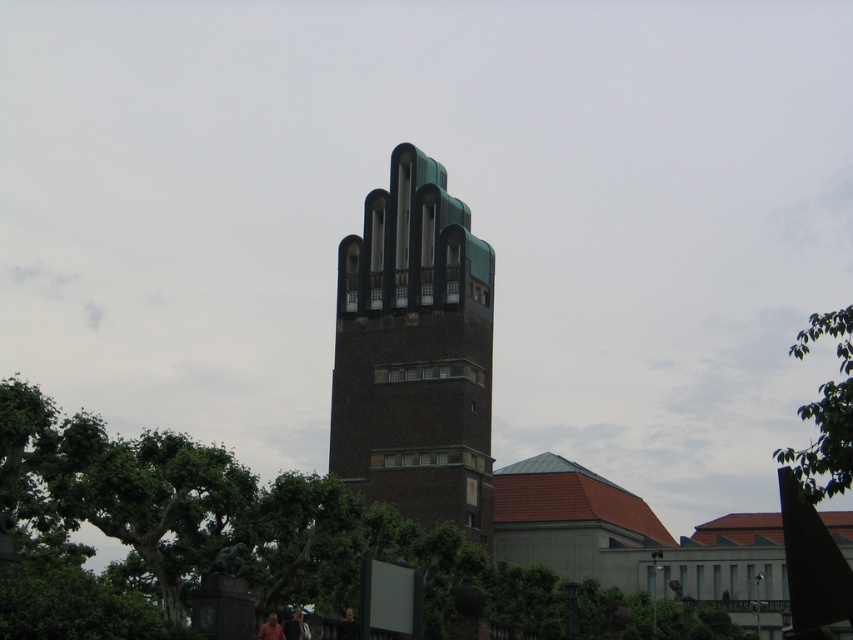
Is brown brick tower at center taller than green leafy tree at upper right?

Yes.

Can you confirm if brown brick tower at center is bigger than green leafy tree at upper right?

No, brown brick tower at center is not bigger than green leafy tree at upper right.

Locate an element on the screen. brown brick tower at center is located at coordinates (415, 353).

Is green leafy tree at center below green leafy tree at upper right?

Indeed, green leafy tree at center is positioned under green leafy tree at upper right.

The image size is (853, 640). Describe the element at coordinates (207, 534) in the screenshot. I see `green leafy tree at center` at that location.

Is point (456, 572) behind point (817, 390)?

No.

Locate an element on the screen. The width and height of the screenshot is (853, 640). green leafy tree at center is located at coordinates (207, 534).

Does green leafy tree at center have a lesser width compared to brown brick tower at center?

No, green leafy tree at center is not thinner than brown brick tower at center.

Is the position of green leafy tree at center more distant than that of brown brick tower at center?

No, it is in front of brown brick tower at center.

Find the location of a particular element. green leafy tree at center is located at coordinates (207, 534).